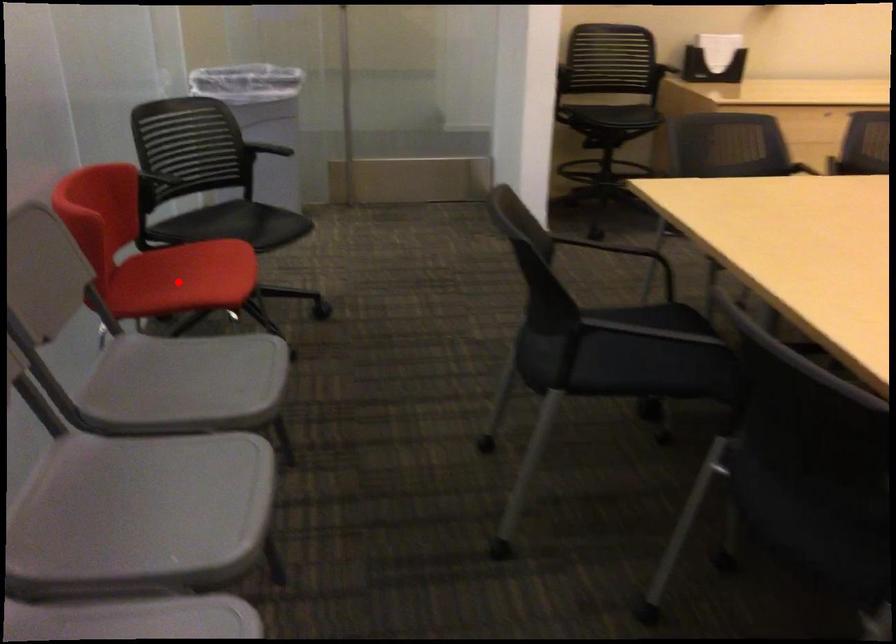
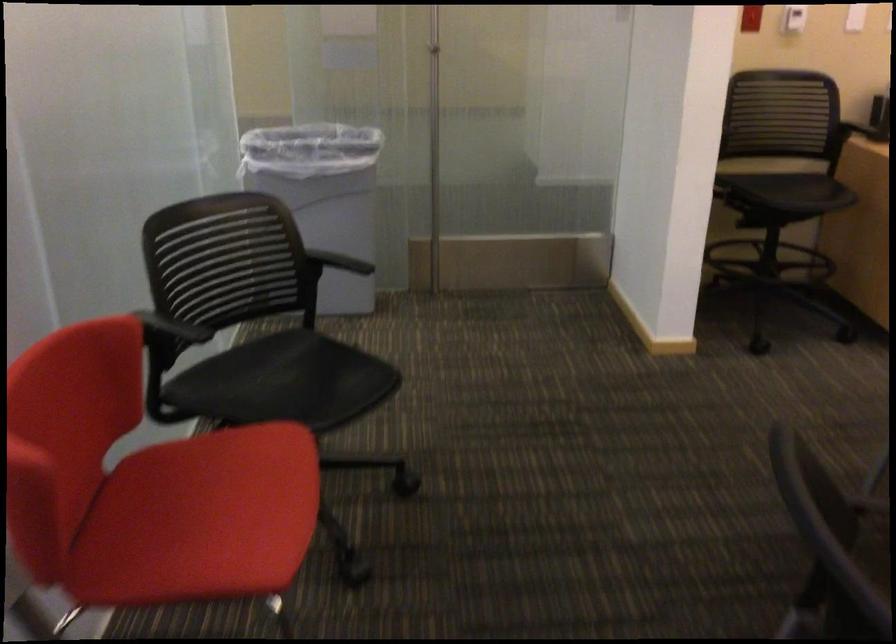
In the second image, find the point that corresponds to the highlighted location in the first image.

(200, 518)